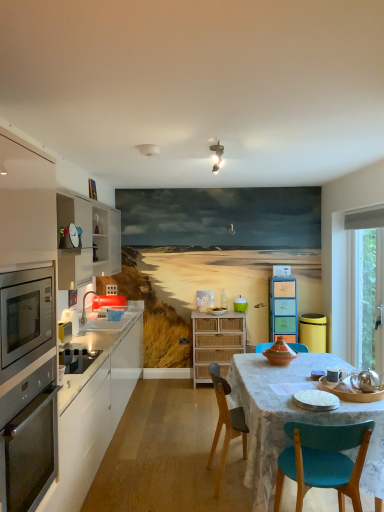
Locate an element on the screen. The image size is (384, 512). vacant space to the left of white ceramic plates at center, the 2th appliance in the bottom-to-top sequence is located at coordinates (271, 402).